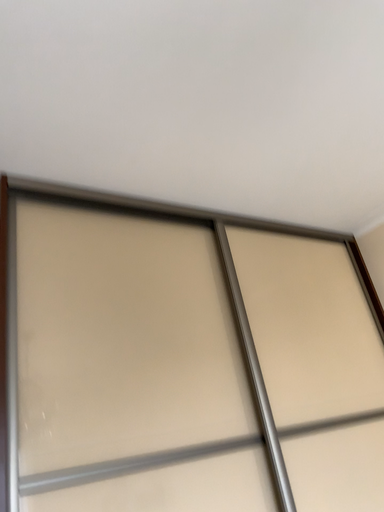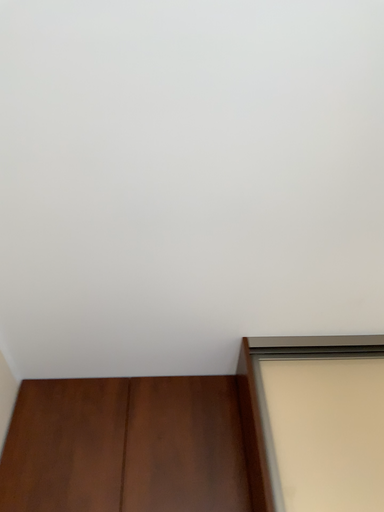
Question: Which way did the camera rotate in the video?

Choices:
 (A) rotated downward
 (B) rotated upward

Answer: (B)